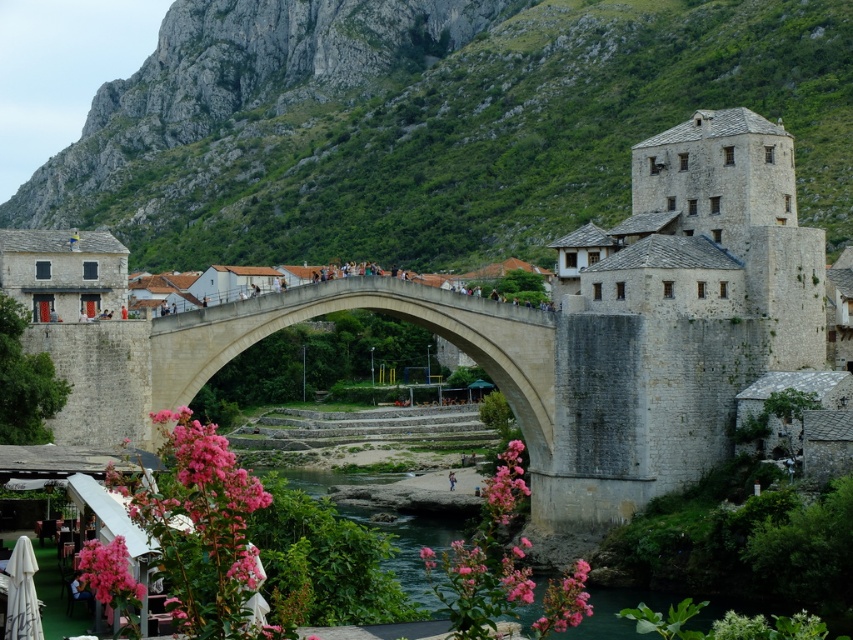
You are a photographer planning to capture the historic stone bridge and its surroundings. You notice the green rocky mountain at upper center and the pink matte flower at center in your viewfinder. Which object should you adjust your camera to focus on if you want to highlight the larger width in your composition?

The green rocky mountain at upper center has a larger width than the pink matte flower at center, so you should focus on the green rocky mountain at upper center to highlight the larger width in your composition.